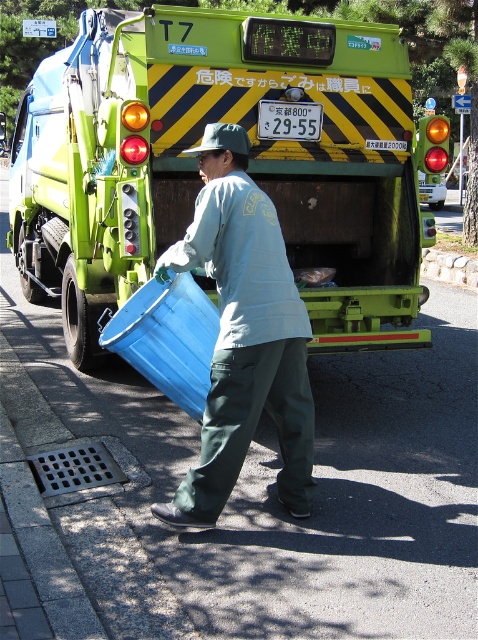
You are standing at the point with coordinates point (x=217, y=275) and want to move to the point with coordinates point (x=366, y=60). Which direction should you move in?

You should move backward because point (x=366, y=60) is behind point (x=217, y=275).

You are a delivery person who needs to park your van near the green matte truck at center. According to the coordinates provided, where exactly should you position your van to ensure it aligns correctly with the truck?

The green matte truck at center is located at coordinates point (249, 170), so you should position your van at the same coordinates to align correctly with it.

You are a city planner analyzing the street layout. The green matte truck at center and the matte blue plastic bin at center are both in the center of the image. Which object is shorter?

The green matte truck at center has a lesser height compared to the matte blue plastic bin at center, so the green matte truck at center is shorter.